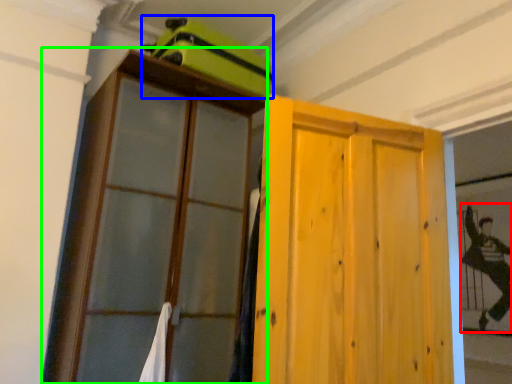
Question: Which object is positioned farthest from couple (highlighted by a red box)? Select from luggage (highlighted by a blue box) and cupboard (highlighted by a green box).

Choices:
 (A) luggage
 (B) cupboard

Answer: (B)